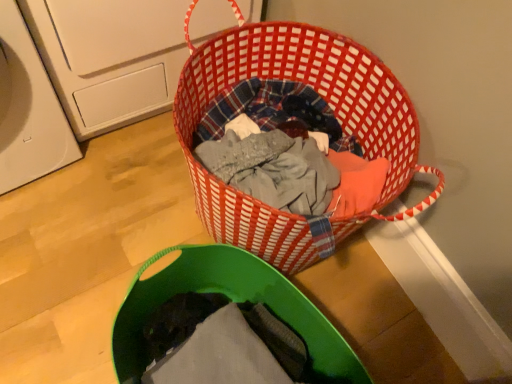
Question: Is red woven basket at center turned away from green fabric laundry basket at lower center?

Choices:
 (A) yes
 (B) no

Answer: (B)

Question: Considering the relative sizes of red woven basket at center and green fabric laundry basket at lower center in the image provided, is red woven basket at center bigger than green fabric laundry basket at lower center?

Choices:
 (A) yes
 (B) no

Answer: (A)

Question: Can you confirm if red woven basket at center is thinner than green fabric laundry basket at lower center?

Choices:
 (A) yes
 (B) no

Answer: (B)

Question: Is red woven basket at center positioned beyond the bounds of green fabric laundry basket at lower center?

Choices:
 (A) yes
 (B) no

Answer: (A)

Question: Considering the relative positions of red woven basket at center and green fabric laundry basket at lower center in the image provided, is red woven basket at center to the right of green fabric laundry basket at lower center from the viewer's perspective?

Choices:
 (A) yes
 (B) no

Answer: (A)

Question: From the image's perspective, is red woven basket at center over green fabric laundry basket at lower center?

Choices:
 (A) no
 (B) yes

Answer: (B)

Question: Is green fabric laundry basket at lower center to the right of red woven basket at center from the viewer's perspective?

Choices:
 (A) yes
 (B) no

Answer: (B)

Question: Is green fabric laundry basket at lower center smaller than red woven basket at center?

Choices:
 (A) no
 (B) yes

Answer: (B)

Question: From a real-world perspective, is green fabric laundry basket at lower center over red woven basket at center?

Choices:
 (A) no
 (B) yes

Answer: (B)

Question: Is green fabric laundry basket at lower center oriented away from red woven basket at center?

Choices:
 (A) yes
 (B) no

Answer: (B)

Question: Is green fabric laundry basket at lower center shorter than red woven basket at center?

Choices:
 (A) yes
 (B) no

Answer: (A)

Question: Considering the relative positions of green fabric laundry basket at lower center and red woven basket at center in the image provided, is green fabric laundry basket at lower center behind red woven basket at center?

Choices:
 (A) yes
 (B) no

Answer: (B)

Question: Is the depth of white plastic washing machine at left less than that of red woven basket at center?

Choices:
 (A) yes
 (B) no

Answer: (B)